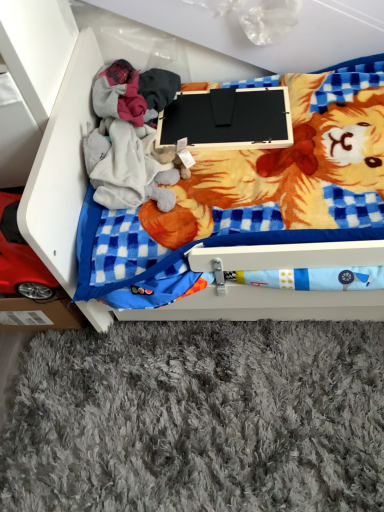
Question: In terms of height, does red plastic toy car at lower left look taller or shorter compared to wooden drawer at center?

Choices:
 (A) tall
 (B) short

Answer: (B)

Question: In terms of width, does red plastic toy car at lower left look wider or thinner when compared to wooden drawer at center?

Choices:
 (A) thin
 (B) wide

Answer: (A)

Question: Which is farther from the red plastic toy car at lower left?

Choices:
 (A) black matte laptop at center
 (B) wooden drawer at center

Answer: (A)

Question: Which object is the closest to the wooden drawer at center?

Choices:
 (A) red plastic toy car at lower left
 (B) black matte laptop at center

Answer: (A)